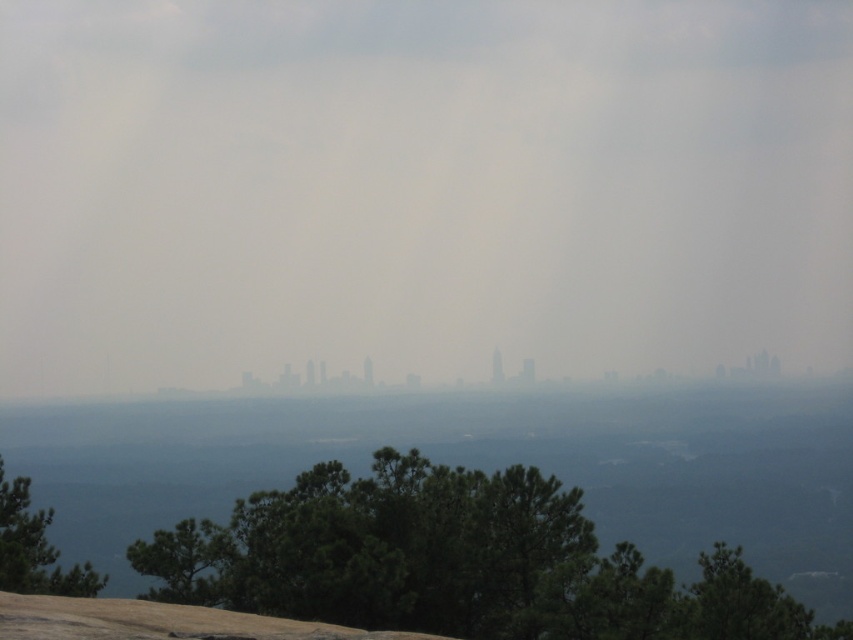
Question: Which point appears farthest from the camera in this image?

Choices:
 (A) (850, 353)
 (B) (482, 620)

Answer: (A)

Question: Can you confirm if foggy sky at center is positioned to the left of green leafy tree at lower center?

Choices:
 (A) yes
 (B) no

Answer: (A)

Question: Which of the following is the farthest from the observer?

Choices:
 (A) (38, 563)
 (B) (370, 86)
 (C) (519, 634)

Answer: (B)

Question: Estimate the real-world distances between objects in this image. Which object is closer to the foggy sky at center?

Choices:
 (A) green matte tree at lower left
 (B) green leafy tree at lower center

Answer: (B)

Question: Does foggy sky at center lie in front of green matte tree at lower left?

Choices:
 (A) no
 (B) yes

Answer: (A)

Question: Can you confirm if green leafy tree at lower center is smaller than green matte tree at lower left?

Choices:
 (A) yes
 (B) no

Answer: (A)